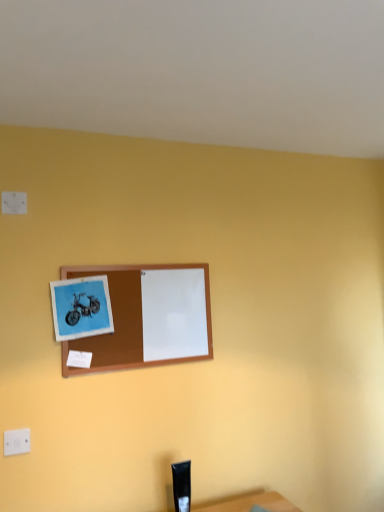
Question: Is brown wooden picture frame at center directly adjacent to white plastic electric outlet at lower left?

Choices:
 (A) no
 (B) yes

Answer: (A)

Question: Can you confirm if brown wooden picture frame at center is bigger than white plastic electric outlet at lower left?

Choices:
 (A) yes
 (B) no

Answer: (A)

Question: Could you tell me if brown wooden picture frame at center is turned towards white plastic electric outlet at lower left?

Choices:
 (A) no
 (B) yes

Answer: (A)

Question: From the image's perspective, is brown wooden picture frame at center below white plastic electric outlet at lower left?

Choices:
 (A) no
 (B) yes

Answer: (A)

Question: Is brown wooden picture frame at center taller than white plastic electric outlet at lower left?

Choices:
 (A) no
 (B) yes

Answer: (B)

Question: Is brown wooden picture frame at center smaller than white plastic electric outlet at lower left?

Choices:
 (A) yes
 (B) no

Answer: (B)

Question: Is there a large distance between white plastic electric outlet at lower left and brown wooden picture frame at center?

Choices:
 (A) no
 (B) yes

Answer: (A)

Question: Would you say brown wooden picture frame at center is part of white plastic electric outlet at lower left's contents?

Choices:
 (A) yes
 (B) no

Answer: (B)

Question: Is white plastic electric outlet at lower left facing towards brown wooden picture frame at center?

Choices:
 (A) yes
 (B) no

Answer: (B)

Question: Does white plastic electric outlet at lower left have a greater width compared to brown wooden picture frame at center?

Choices:
 (A) yes
 (B) no

Answer: (B)

Question: Is white plastic electric outlet at lower left closer to camera compared to brown wooden picture frame at center?

Choices:
 (A) no
 (B) yes

Answer: (B)

Question: Considering the relative sizes of white plastic electric outlet at lower left and brown wooden picture frame at center in the image provided, is white plastic electric outlet at lower left bigger than brown wooden picture frame at center?

Choices:
 (A) no
 (B) yes

Answer: (A)

Question: From the image's perspective, relative to white plastic electric outlet at lower left, is brown wooden picture frame at center above or below?

Choices:
 (A) above
 (B) below

Answer: (A)